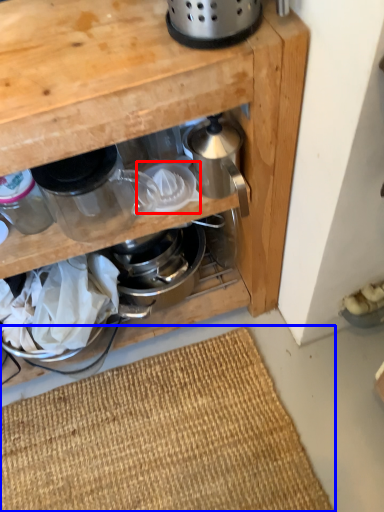
Question: Which point is further to the camera, appliance (highlighted by a red box) or doormat (highlighted by a blue box)?

Choices:
 (A) appliance
 (B) doormat

Answer: (B)